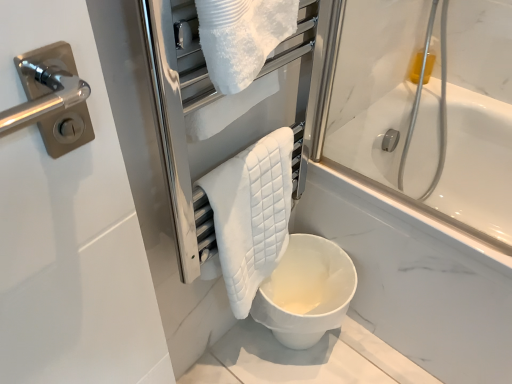
Question: Based on their sizes in the image, would you say white quilted towel at center is bigger or smaller than white quilted towel at center?

Choices:
 (A) big
 (B) small

Answer: (B)

Question: Relative to white quilted towel at center, is white quilted towel at center in front or behind?

Choices:
 (A) behind
 (B) front

Answer: (A)

Question: Which object is positioned farthest from the white matte toilet at lower center?

Choices:
 (A) white quilted towel at center
 (B) white quilted towel at center

Answer: (B)

Question: Which object is the farthest from the white matte toilet at lower center?

Choices:
 (A) white quilted towel at center
 (B) white quilted towel at center

Answer: (A)